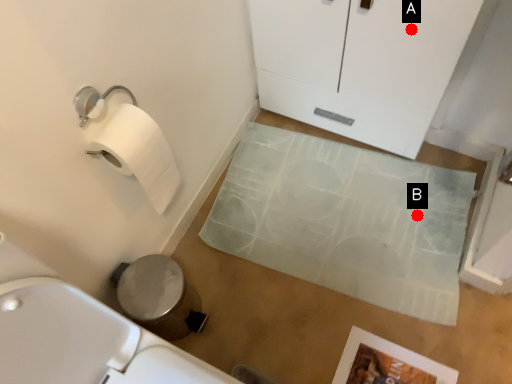
Question: Two points are circled on the image, labeled by A and B beside each circle. Which point is closer to the camera?

Choices:
 (A) A is closer
 (B) B is closer

Answer: (A)